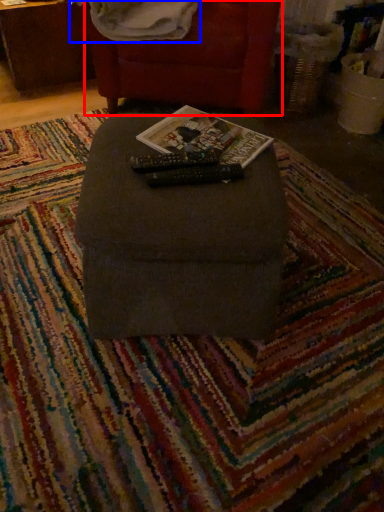
Question: Which object is further to the camera taking this photo, furniture (highlighted by a red box) or blanket (highlighted by a blue box)?

Choices:
 (A) furniture
 (B) blanket

Answer: (A)